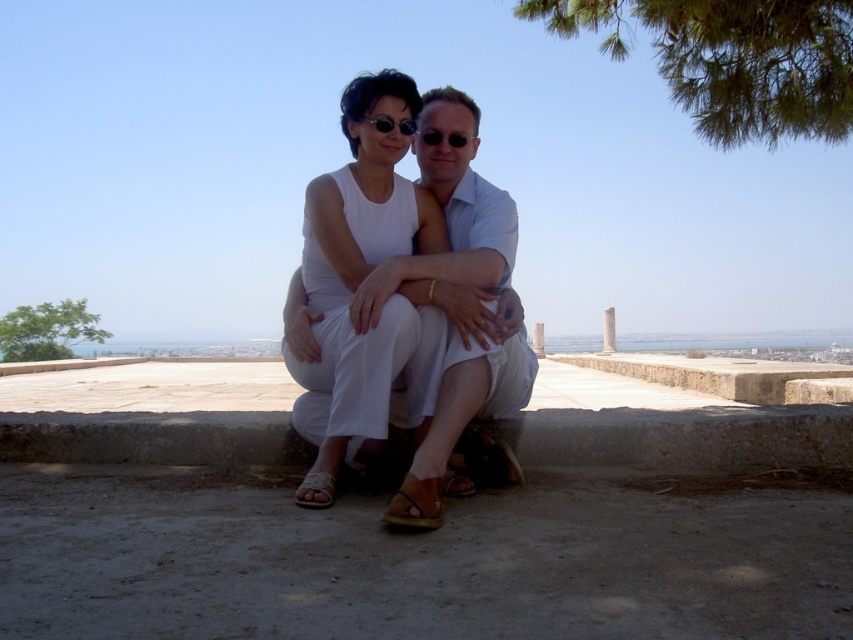
Can you confirm if brown leather sandal at lower center is wider than leather sandal at lower center?

Correct, the width of brown leather sandal at lower center exceeds that of leather sandal at lower center.

Is brown leather sandal at lower center thinner than leather sandal at lower center?

Incorrect, brown leather sandal at lower center's width is not less than leather sandal at lower center's.

Measure the distance between point (421,500) and camera.

They are 3.21 meters apart.

Where is `brown leather sandal at lower center`? brown leather sandal at lower center is located at coordinates (415, 504).

Is white cotton dress at center smaller than leather sandal at lower center?

No.

Locate an element on the screen. The height and width of the screenshot is (640, 853). white cotton dress at center is located at coordinates (453, 292).

Can you confirm if white cotton dress at center is shorter than matte black sunglasses at center?

No, white cotton dress at center is not shorter than matte black sunglasses at center.

Can you confirm if white cotton dress at center is taller than matte black sunglasses at center?

Indeed, white cotton dress at center has a greater height compared to matte black sunglasses at center.

The image size is (853, 640). I want to click on white cotton dress at center, so click(453, 292).